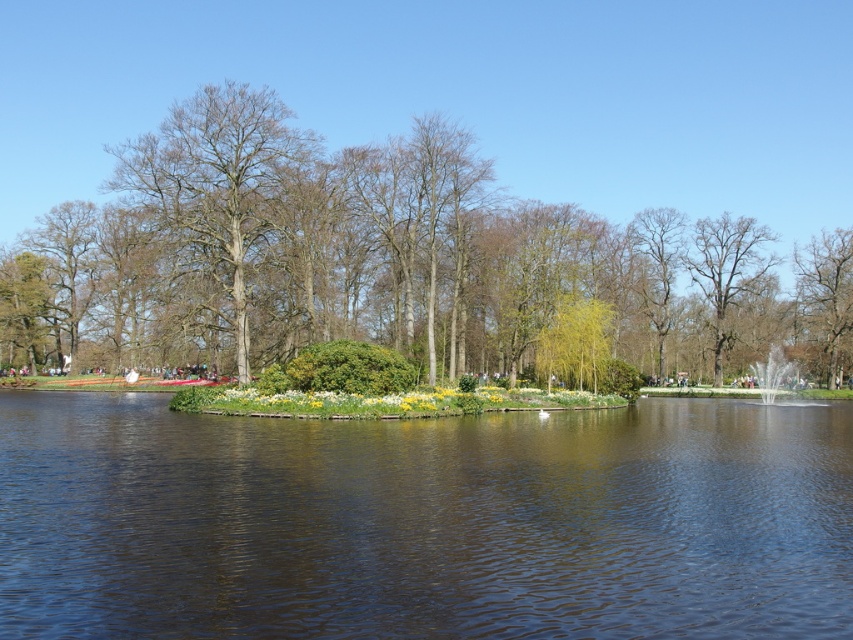
You are standing at the edge of the water in the park and see two points marked in the image. The first point is at coordinate point (x=231, y=340) and the second is at point (x=828, y=273). Which point is closer to you?

Point (x=231, y=340) is in front of point (x=828, y=273), so the first point is closer to you.